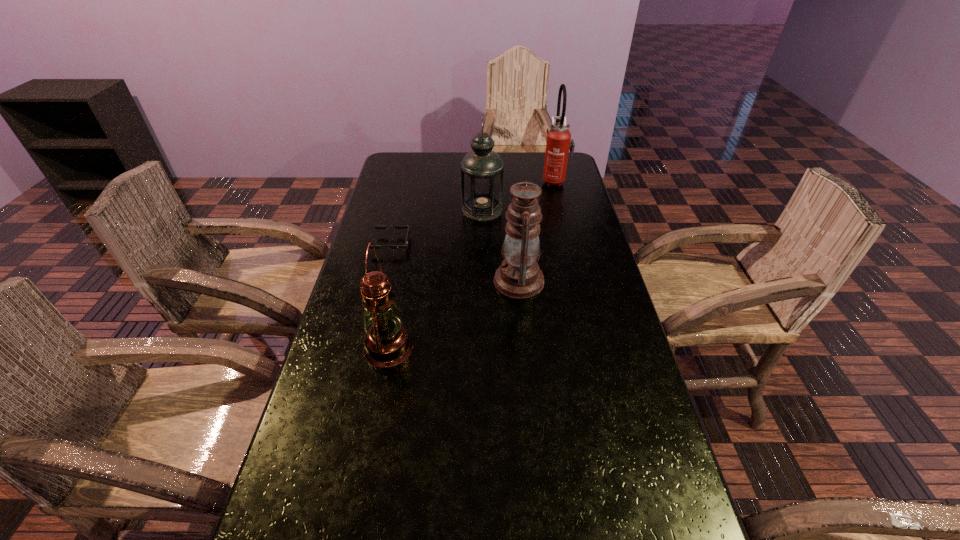
The width and height of the screenshot is (960, 540). In the image, there is a desktop. In order to click on vacant space at the left edge in this screenshot , I will do `click(297, 455)`.

Locate an element on the screen. The width and height of the screenshot is (960, 540). vacant space at the right edge of the desktop is located at coordinates (562, 244).

Locate an element on the screen. The width and height of the screenshot is (960, 540). vacant space at the far left corner of the desktop is located at coordinates [x=410, y=167].

I want to click on vacant area at the far right corner of the desktop, so click(539, 151).

Where is `vacant space in between the sunglasses and the farthest oil lamp`? The image size is (960, 540). vacant space in between the sunglasses and the farthest oil lamp is located at coordinates (437, 227).

Where is `vacant area between the nearest oil lamp and the farthest oil lamp`? The height and width of the screenshot is (540, 960). vacant area between the nearest oil lamp and the farthest oil lamp is located at coordinates (435, 279).

The image size is (960, 540). In order to click on free spot between the shortest object and the farthest oil lamp in this screenshot , I will do click(437, 227).

Locate which object is the second closest to the second farthest oil lamp. Please provide its 2D coordinates. Your answer should be formatted as a tuple, i.e. [(x, y)], where the tuple contains the x and y coordinates of a point satisfying the conditions above.

[(387, 343)]

Identify which object is the second closest to the fourth nearest object. Please provide its 2D coordinates. Your answer should be formatted as a tuple, i.e. [(x, y)], where the tuple contains the x and y coordinates of a point satisfying the conditions above.

[(559, 141)]

Find the location of a particular element. The image size is (960, 540). the third closest oil lamp to the third nearest object is located at coordinates (387, 343).